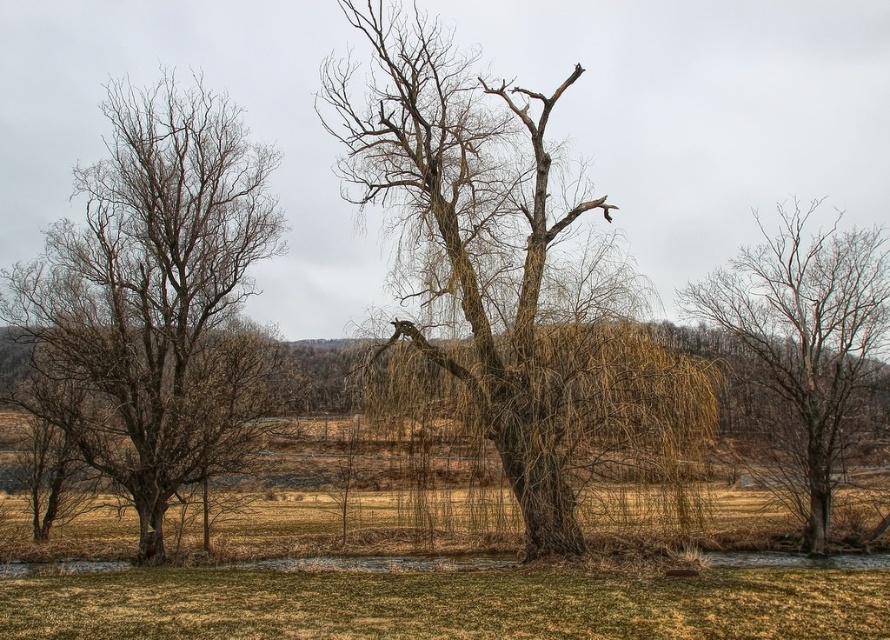
Consider the image. Between bare branches at left and brown dry grass at lower center, which one appears on the right side from the viewer's perspective?

brown dry grass at lower center is more to the right.

Is bare branches at left wider than brown dry grass at lower center?

No.

Does point (50, 248) come in front of point (803, 609)?

No, it is not.

The width and height of the screenshot is (890, 640). Identify the location of bare branches at left. (155, 300).

Which is below, brown textured tree at center or bare branches at left?

bare branches at left is below.

Which is in front, point (528, 356) or point (200, 259)?

Positioned in front is point (528, 356).

Who is more distant from viewer, (445, 240) or (128, 115)?

The point (128, 115) is more distant.

Where is `brown textured tree at center`? The width and height of the screenshot is (890, 640). brown textured tree at center is located at coordinates (502, 268).

Measure the distance between point (878, 595) and camera.

The distance of point (878, 595) from camera is 60.93 feet.

Find the location of `brown dry grass at lower center`. brown dry grass at lower center is located at coordinates (447, 604).